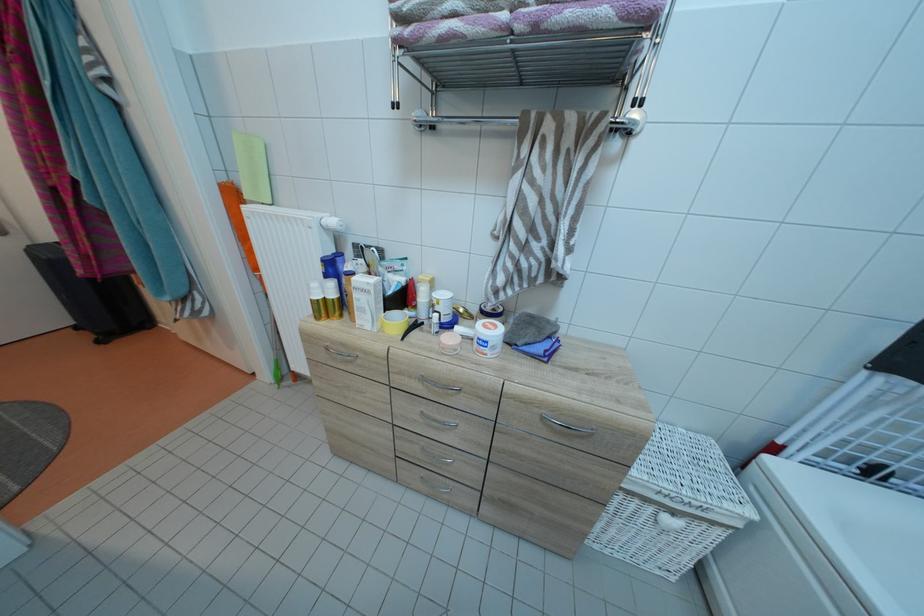
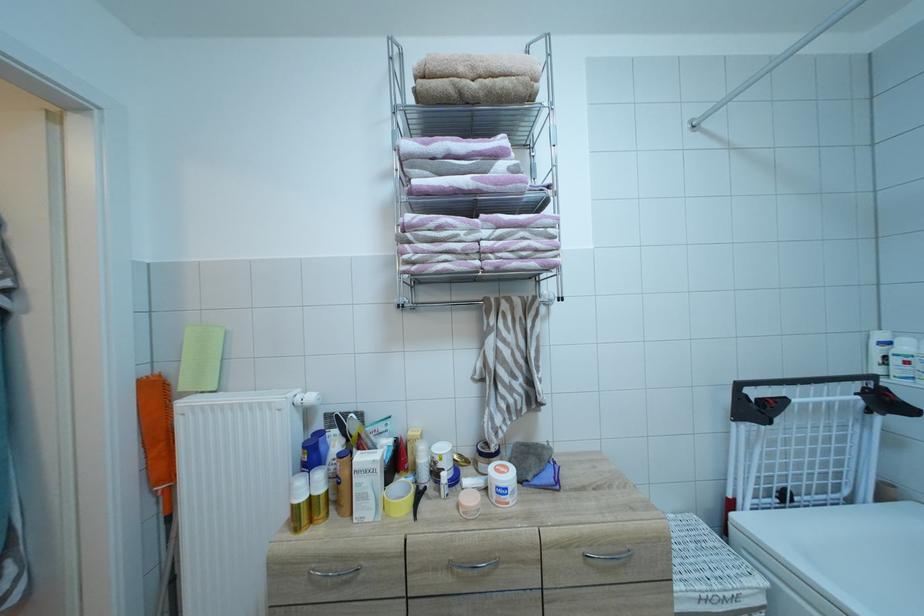
The first image is from the beginning of the video and the second image is from the end. How did the camera likely rotate when shooting the video?

The camera rotated toward right-up.